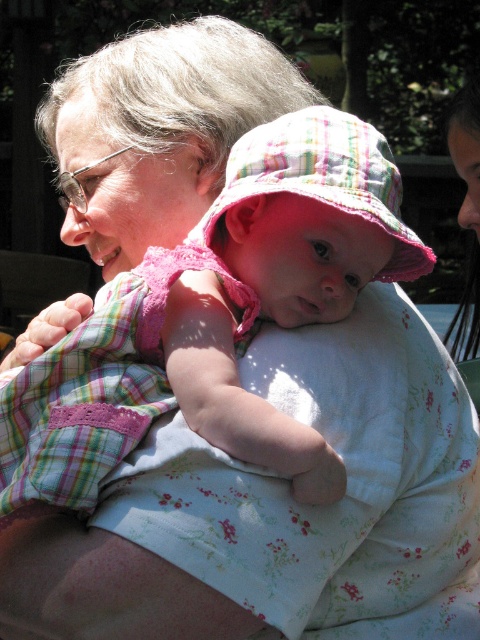
Based on the scene description, which object, the pink plaid dress at center or the pink plaid hat at center, is positioned higher up in the image?

The pink plaid dress at center is positioned higher up in the image than the pink plaid hat at center because the dress is much taller as the hat.

You are standing in the garden scene and want to place a small flowerpot between the two points labeled point [1,422] and point [291,113]. Which point should the flowerpot be closer to if it needs to be nearer to the viewer?

The flowerpot should be placed closer to point [1,422] because it is closer to the viewer than point [291,113].

You are a photographer trying to capture the baby in the image. The baby is wearing a pink sunhat with multicolored stripes and resting in the arms of an older person. You need to adjust your camera focus to ensure both the pink plaid dress at center and the pink plaid hat at center are sharp. Which object should you focus on first to ensure proper alignment?

You should focus on the pink plaid dress at center first because it is positioned to the left of the pink plaid hat at center, so focusing on the leftmost object ensures proper alignment for both.